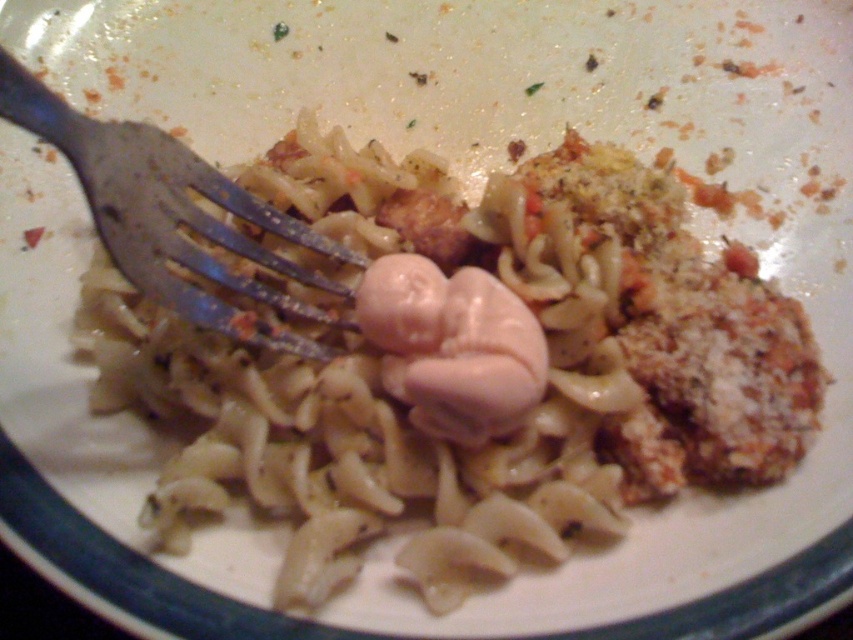
You are a person sitting at a table with the plate of pasta in front of you. You want to pick up the brown crispy meat at center with the metallic silver fork at left. Can you reach it with the fork without moving the fork?

The metallic silver fork at left is below the brown crispy meat at center, so you can reach the brown crispy meat at center with the fork without moving it.

You are a photographer trying to capture the plate of pasta. You notice two points on the plate marked as point (x=416, y=266) and point (x=399, y=218). Which point will appear larger in your photo?

Point (x=416, y=266) will appear larger in the photo because it is closer to the camera than point (x=399, y=218).

You are a food critic evaluating the presentation of this pasta dish. The dish contains both pink matte meat at center and brown crispy meat at center. Which piece of meat has a greater width?

The pink matte meat at center has a greater width than the brown crispy meat at center.